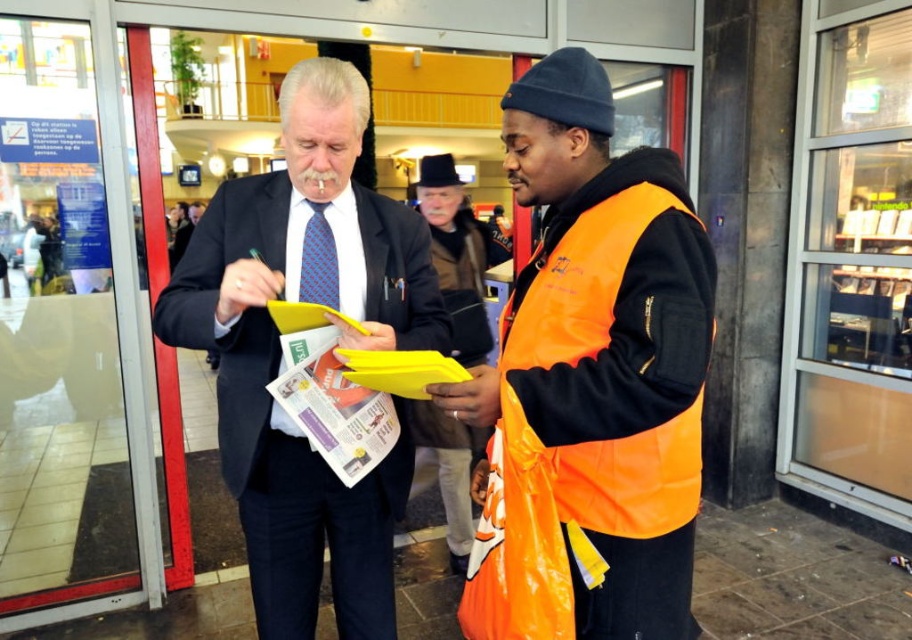
What do you see at coordinates (281, 358) in the screenshot? I see `matte black suit at center` at bounding box center [281, 358].

Is matte black suit at center closer to camera compared to blue textured tie at center?

Yes, it is in front of blue textured tie at center.

Consider the image. Who is more distant from viewer, (306, 189) or (330, 298)?

The point (330, 298) is more distant.

Locate an element on the screen. Image resolution: width=912 pixels, height=640 pixels. matte black suit at center is located at coordinates (281, 358).

Does orange reflective vest at center have a lesser width compared to blue textured tie at center?

Incorrect, orange reflective vest at center's width is not less than blue textured tie at center's.

Is point (539, 515) farther from viewer compared to point (309, 240)?

That is False.

Where is `orange reflective vest at center`? orange reflective vest at center is located at coordinates (591, 380).

Is orange reflective vest at center taller than matte black suit at center?

No, orange reflective vest at center is not taller than matte black suit at center.

Is point (627, 611) positioned behind point (421, 320)?

No, (627, 611) is closer to viewer.

This screenshot has width=912, height=640. Find the location of `orange reflective vest at center`. orange reflective vest at center is located at coordinates (591, 380).